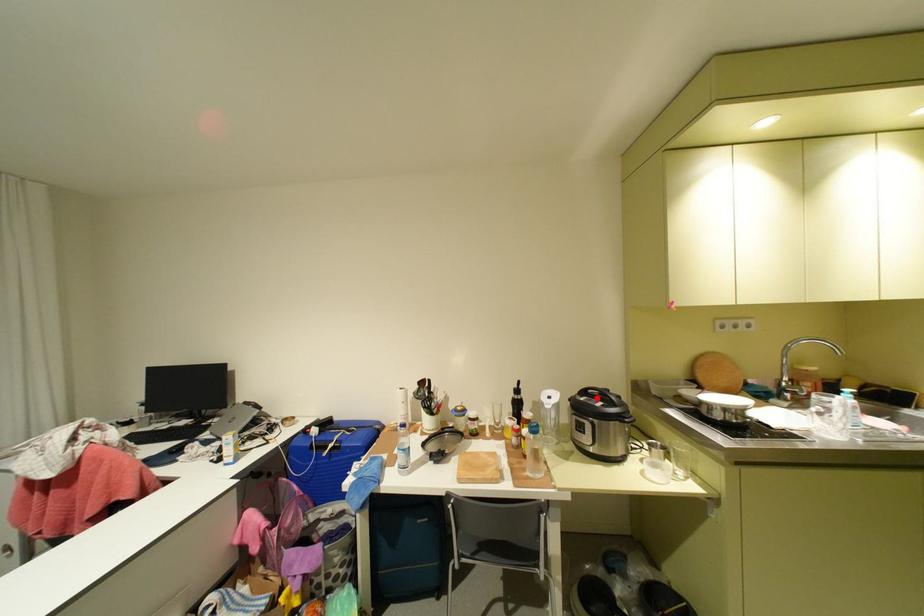
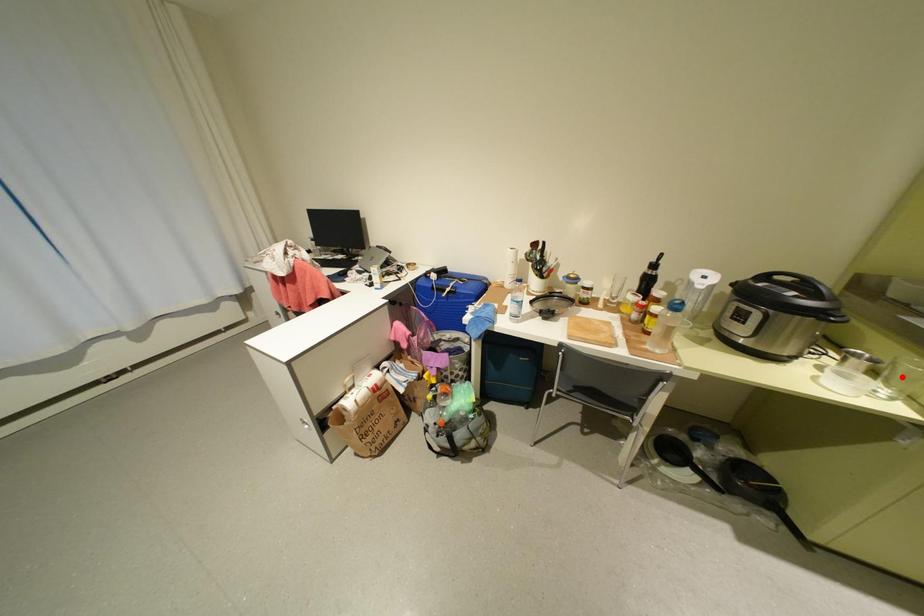
I am providing you with two images of the same scene from different viewpoints. A red point is marked on the first image and another point is marked on the second image. Are the points marked in image1 and image2 representing the same 3D position?

No